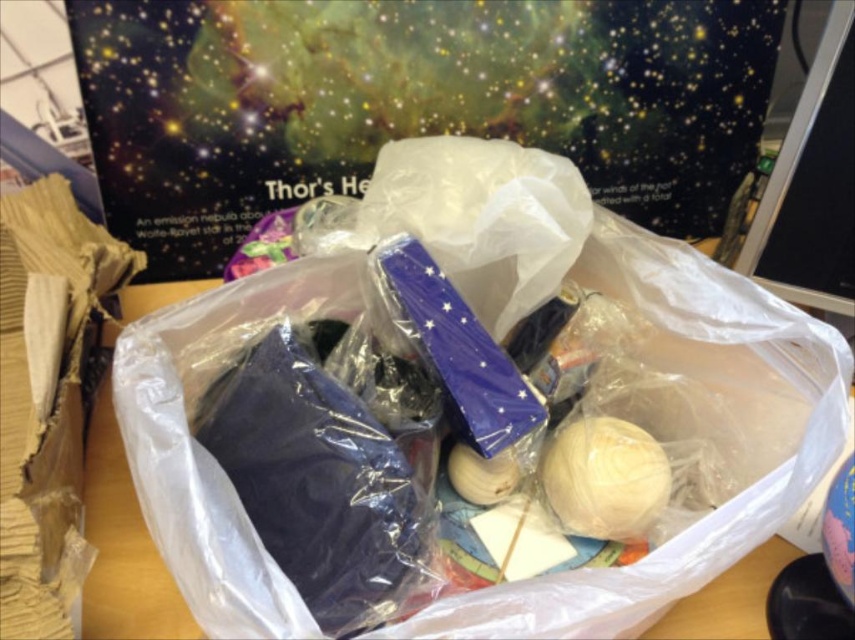
Looking at this image, who is more forward, [463,193] or [649,506]?

Positioned in front is point [649,506].

Measure the distance between point (x=463, y=196) and camera.

Point (x=463, y=196) is 24.17 inches away from camera.

The width and height of the screenshot is (855, 640). Find the location of `translucent plastic bag at center`. translucent plastic bag at center is located at coordinates (653, 317).